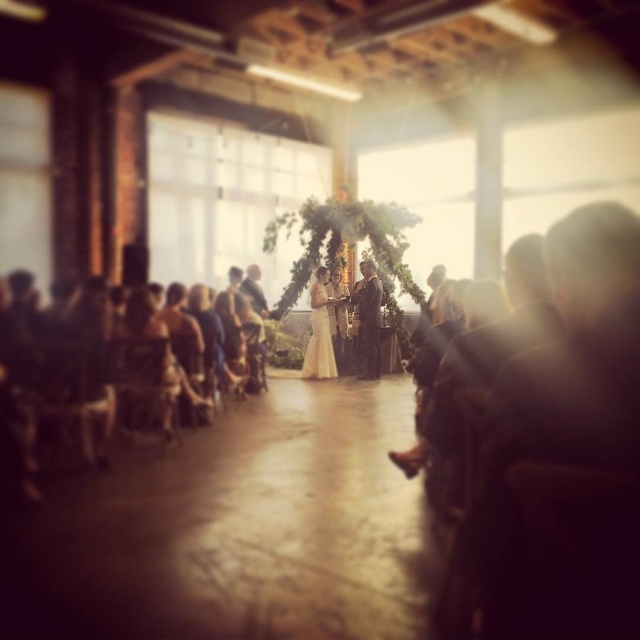
Is smooth wooden floor at center in front of wooden chair at left?

Yes, it is.

Locate an element on the screen. The width and height of the screenshot is (640, 640). smooth wooden floor at center is located at coordinates tap(236, 531).

At what (x,y) coordinates should I click in order to perform the action: click on smooth wooden floor at center. Please return your answer as a coordinate pair (x, y). The height and width of the screenshot is (640, 640). Looking at the image, I should click on (236, 531).

Identify the location of smooth wooden floor at center. 236,531.

Consider the image. Does dark brown leather jacket at center lie in front of white satin dress at center?

No, dark brown leather jacket at center is behind white satin dress at center.

Can you confirm if dark brown leather jacket at center is positioned to the right of white satin dress at center?

Indeed, dark brown leather jacket at center is positioned on the right side of white satin dress at center.

The height and width of the screenshot is (640, 640). What do you see at coordinates (368, 321) in the screenshot?
I see `dark brown leather jacket at center` at bounding box center [368, 321].

Locate an element on the screen. dark brown leather jacket at center is located at coordinates (368, 321).

Is wooden chair at left further to camera compared to white satin dress at center?

No.

Is the position of wooden chair at left less distant than that of white satin dress at center?

Yes, it is.

The height and width of the screenshot is (640, 640). In order to click on wooden chair at left in this screenshot , I will do `click(92, 378)`.